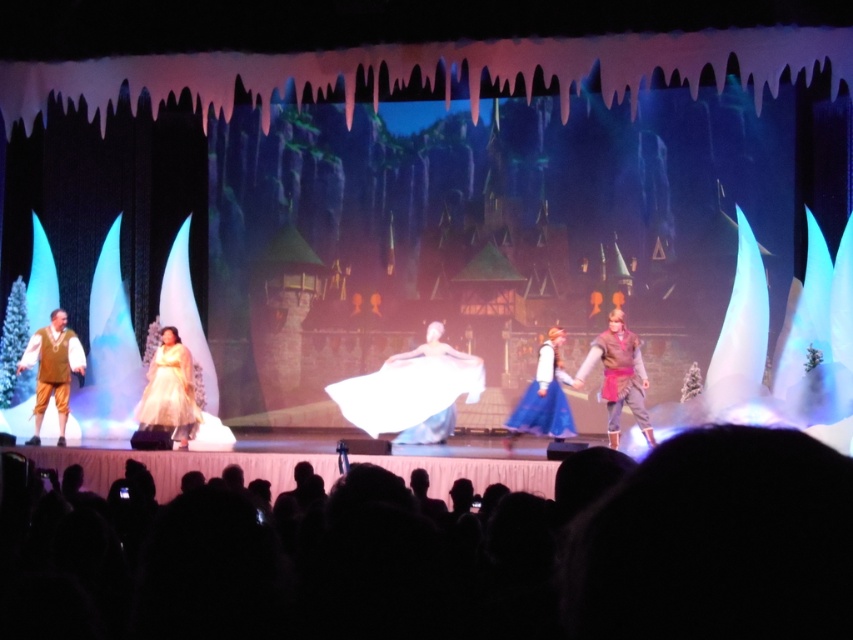
Looking at this image, who is positioned more to the right, brown leather pants at left or blue satin dress at center?

blue satin dress at center

Is brown leather pants at left taller than blue satin dress at center?

Yes.

Find the location of a particular element. The height and width of the screenshot is (640, 853). brown leather pants at left is located at coordinates (51, 369).

Which is in front, point (160, 412) or point (79, 372)?

Point (160, 412) is more forward.

Can you confirm if matte gold dress at center is positioned to the right of brown leather pants at left?

Yes, matte gold dress at center is to the right of brown leather pants at left.

Between point (173, 352) and point (62, 362), which one is positioned in front?

Point (173, 352)

Where is `matte gold dress at center`? matte gold dress at center is located at coordinates (169, 392).

Is white satin dress at center closer to the viewer compared to matte gold dress at center?

That is False.

Can you confirm if white satin dress at center is taller than matte gold dress at center?

Yes.

Does point (369, 396) lie in front of point (190, 360)?

No, (369, 396) is behind (190, 360).

This screenshot has height=640, width=853. I want to click on white satin dress at center, so click(x=412, y=392).